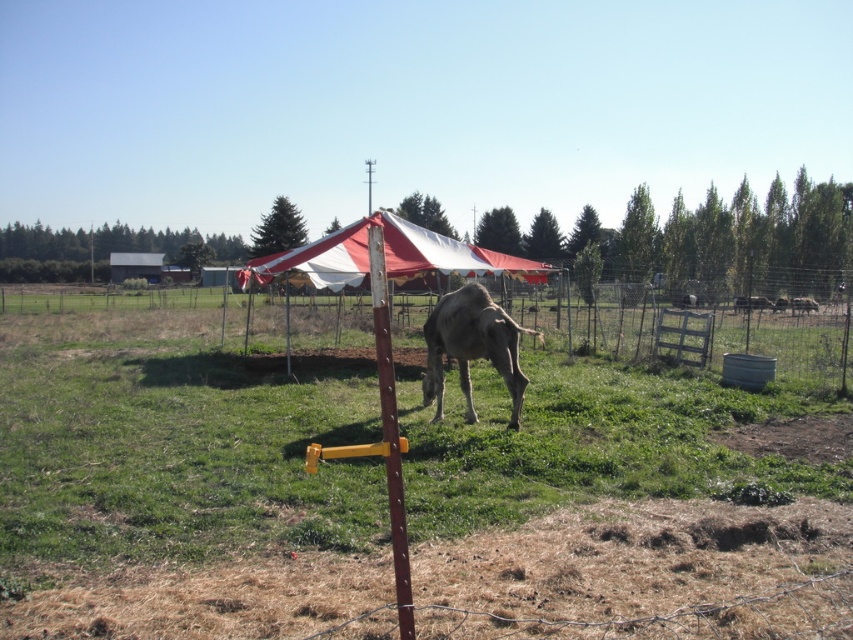
Is red/white fabric canopy at center taller than gray matte camel at center?

Indeed, red/white fabric canopy at center has a greater height compared to gray matte camel at center.

Is point (239, 284) positioned before point (477, 304)?

No, it is not.

Describe the element at coordinates (386, 257) in the screenshot. This screenshot has height=640, width=853. I see `red/white fabric canopy at center` at that location.

Image resolution: width=853 pixels, height=640 pixels. Find the location of `red/white fabric canopy at center`. red/white fabric canopy at center is located at coordinates (386, 257).

Who is lower down, green grass at center or brown matte cow at center?

green grass at center

Which is above, green grass at center or brown matte cow at center?

brown matte cow at center is above.

Who is more forward, (172, 548) or (733, 300)?

Point (172, 548) is more forward.

Locate an element on the screen. The image size is (853, 640). green grass at center is located at coordinates (177, 442).

Does green grass at center have a larger size compared to brown fuzzy camel at center?

Indeed, green grass at center has a larger size compared to brown fuzzy camel at center.

Between green grass at center and brown fuzzy camel at center, which one is positioned higher?

Positioned higher is brown fuzzy camel at center.

Identify the location of green grass at center. This screenshot has height=640, width=853. (177, 442).

What are the coordinates of `green grass at center` in the screenshot? It's located at (177, 442).